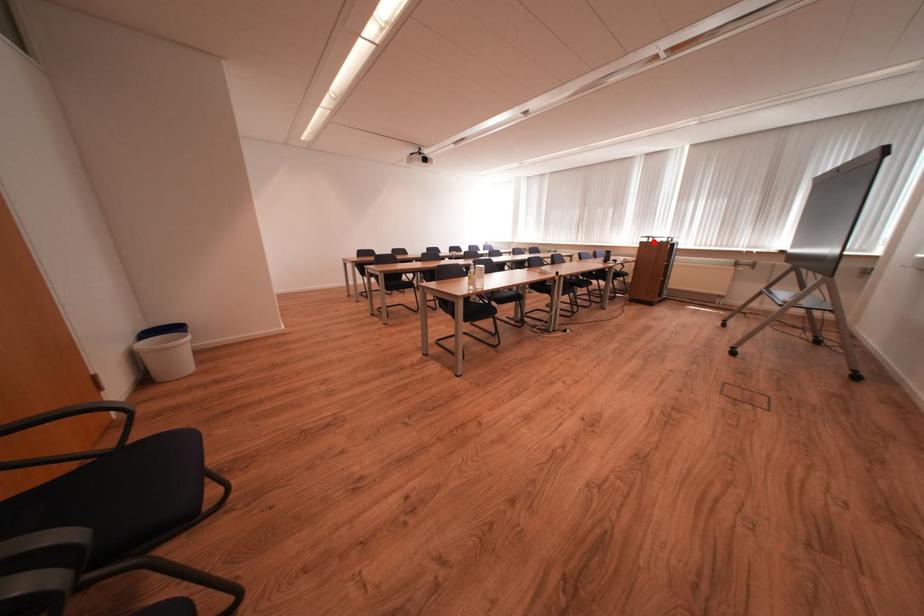
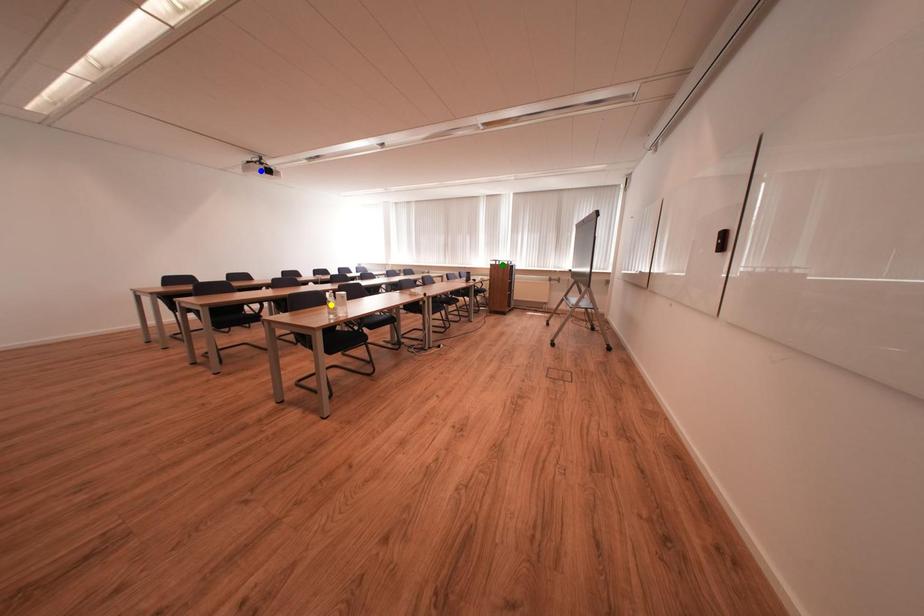
Question: I am providing you with two images of the same scene from different viewpoints. A red point is marked on the first image. You are given multiple points on the second image. Which point in image 2 represents the same 3d spot as the red point in image 1?

Choices:
 (A) green point
 (B) blue point
 (C) yellow point

Answer: (A)